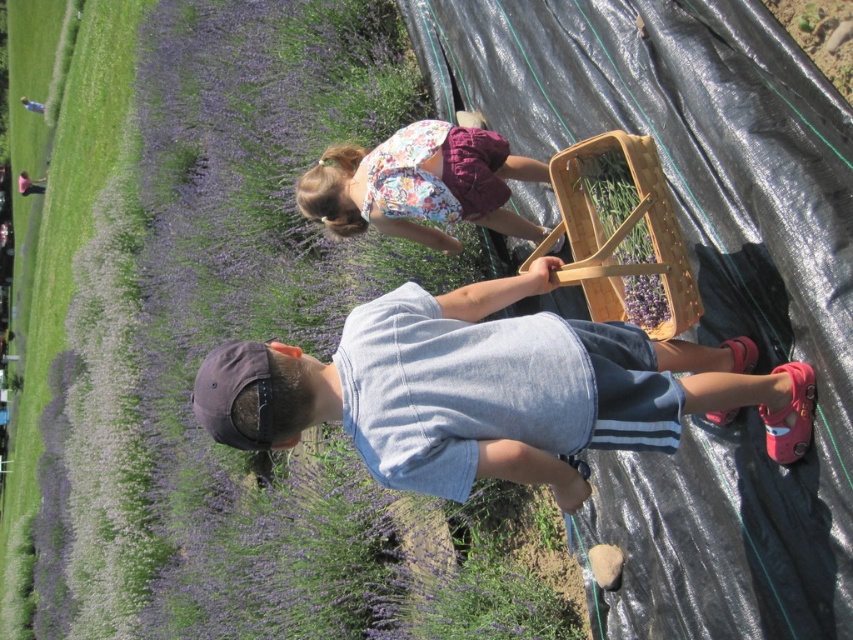
Question: Observing the image, what is the correct spatial positioning of purple soft lavender at upper left in reference to denim shorts at center?

Choices:
 (A) right
 (B) left

Answer: (B)

Question: Which point is farther from the camera taking this photo?

Choices:
 (A) (399, 188)
 (B) (267, 380)

Answer: (A)

Question: Based on their relative distances, which object is farther from the denim shorts at center?

Choices:
 (A) purple soft lavender at upper left
 (B) floral fabric dress at center

Answer: (A)

Question: Does purple soft lavender at upper left appear under floral fabric dress at center?

Choices:
 (A) yes
 (B) no

Answer: (B)

Question: Does purple soft lavender at upper left appear over floral fabric dress at center?

Choices:
 (A) no
 (B) yes

Answer: (B)

Question: Which of the following is the farthest from the observer?

Choices:
 (A) (434, 218)
 (B) (70, 112)
 (C) (770, 422)

Answer: (B)